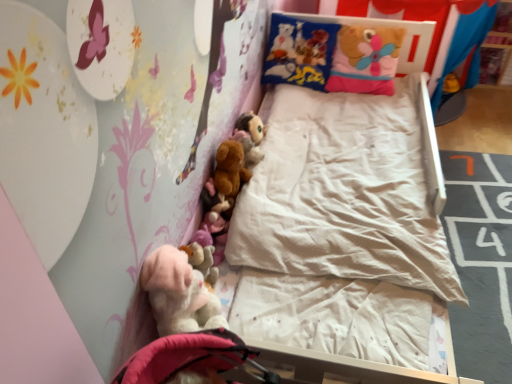
Question: Is the position of fuzzy brown plush at upper center, marked as the 1th toy in a top-to-bottom arrangement, more distant than that of fluffy pink teddy at lower left?

Choices:
 (A) no
 (B) yes

Answer: (B)

Question: Is fuzzy brown plush at upper center, the 1th toy from the back, smaller than fluffy pink teddy at lower left?

Choices:
 (A) yes
 (B) no

Answer: (A)

Question: Does fuzzy brown plush at upper center, the 1th toy from the back, lie in front of fluffy pink teddy at lower left?

Choices:
 (A) yes
 (B) no

Answer: (B)

Question: Is fuzzy brown plush at upper center, marked as the 1th toy in a top-to-bottom arrangement, oriented away from fluffy pink teddy at lower left?

Choices:
 (A) no
 (B) yes

Answer: (A)

Question: From the image's perspective, is fuzzy brown plush at upper center, acting as the third toy starting from the front, under fluffy pink teddy at lower left?

Choices:
 (A) no
 (B) yes

Answer: (A)

Question: Is fluffy pink stuffed animal at lower left, which ranks as the third toy in top-to-bottom order, to the left or to the right of fluffy pink teddy at lower left in the image?

Choices:
 (A) right
 (B) left

Answer: (A)

Question: Considering the positions of fluffy pink stuffed animal at lower left, which ranks as the third toy in top-to-bottom order, and fluffy pink teddy at lower left in the image, is fluffy pink stuffed animal at lower left, which ranks as the third toy in top-to-bottom order, bigger or smaller than fluffy pink teddy at lower left?

Choices:
 (A) big
 (B) small

Answer: (B)

Question: From the image's perspective, is fluffy pink stuffed animal at lower left, the 3th toy in the back-to-front sequence, above or below fluffy pink teddy at lower left?

Choices:
 (A) below
 (B) above

Answer: (B)

Question: In terms of height, does fluffy pink stuffed animal at lower left, arranged as the first toy when ordered from the bottom, look taller or shorter compared to fluffy pink teddy at lower left?

Choices:
 (A) tall
 (B) short

Answer: (B)

Question: From a real-world perspective, relative to soft plush pillow at upper right, is brown plush toy at center, positioned as the 2th toy in top-to-bottom order, vertically above or below?

Choices:
 (A) above
 (B) below

Answer: (B)

Question: Would you say brown plush toy at center, which is the second toy in bottom-to-top order, is inside or outside soft plush pillow at upper right?

Choices:
 (A) inside
 (B) outside

Answer: (B)

Question: Considering the positions of brown plush toy at center, positioned as the 2th toy in top-to-bottom order, and soft plush pillow at upper right in the image, is brown plush toy at center, positioned as the 2th toy in top-to-bottom order, taller or shorter than soft plush pillow at upper right?

Choices:
 (A) tall
 (B) short

Answer: (B)

Question: Based on their positions, is brown plush toy at center, the 2th toy positioned from the back, located to the left or right of soft plush pillow at upper right?

Choices:
 (A) left
 (B) right

Answer: (A)

Question: From the image's perspective, relative to soft plush pillow at upper right, is fuzzy brown plush at upper center, the 1th toy from the back, above or below?

Choices:
 (A) below
 (B) above

Answer: (A)

Question: In terms of height, does fuzzy brown plush at upper center, which ranks as the third toy in bottom-to-top order, look taller or shorter compared to soft plush pillow at upper right?

Choices:
 (A) tall
 (B) short

Answer: (B)